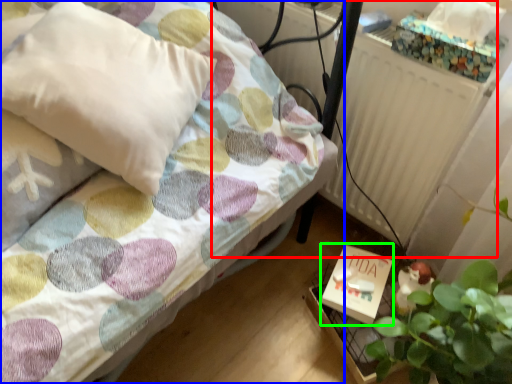
Question: Which object is the closest to the radiator (highlighted by a red box)? Choose among these: bed (highlighted by a blue box) or box (highlighted by a green box).

Choices:
 (A) bed
 (B) box

Answer: (B)